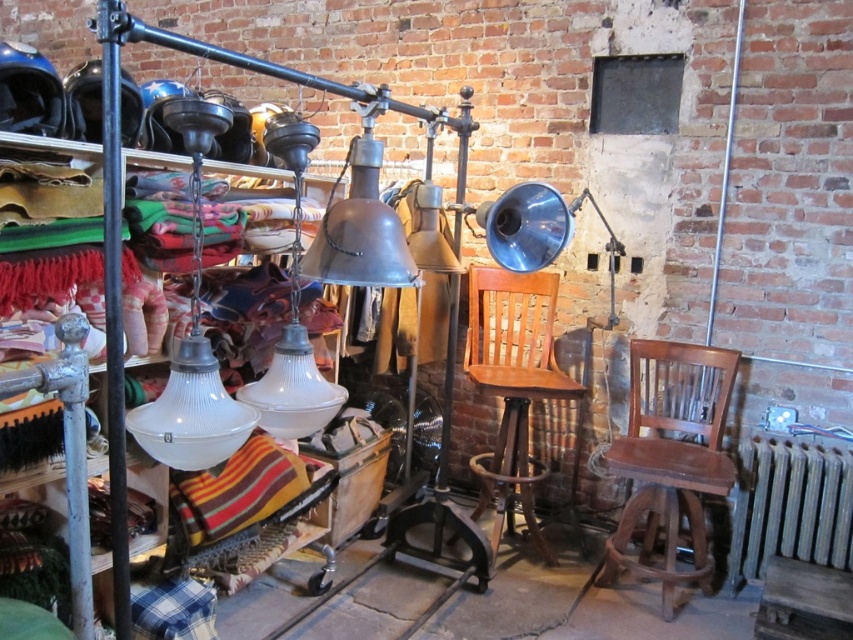
Measure the distance between gray metallic radiator at lower right and camera.

A distance of 2.91 meters exists between gray metallic radiator at lower right and camera.

Is point (781, 460) in front of point (358, 109)?

That is False.

Who is more forward, [785,445] or [395,250]?

Positioned in front is point [395,250].

Find the location of a particular element. This screenshot has width=853, height=640. gray metallic radiator at lower right is located at coordinates (788, 506).

Can you confirm if gray metallic radiator at lower right is positioned below polished metal pole at left?

Correct, gray metallic radiator at lower right is located below polished metal pole at left.

Does point (851, 557) come farther from viewer compared to point (128, 627)?

Yes, it is.

Image resolution: width=853 pixels, height=640 pixels. I want to click on gray metallic radiator at lower right, so click(788, 506).

Based on the photo, which is more to the left, white glass lamp at lower left or metallic bell-shaped lamp at center?

From the viewer's perspective, white glass lamp at lower left appears more on the left side.

Which is in front, point (216, 458) or point (366, 148)?

Point (216, 458) is in front.

I want to click on white glass lamp at lower left, so click(x=193, y=336).